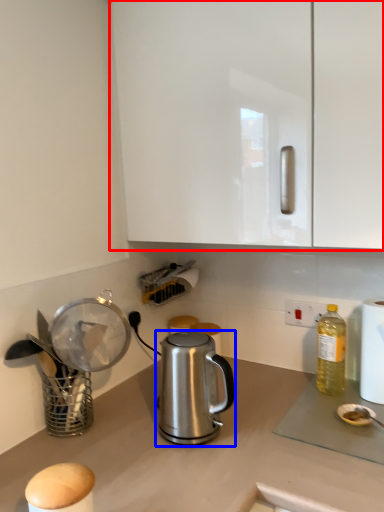
Question: Among these objects, which one is farthest to the camera, cabinetry (highlighted by a red box) or kettle (highlighted by a blue box)?

Choices:
 (A) cabinetry
 (B) kettle

Answer: (B)